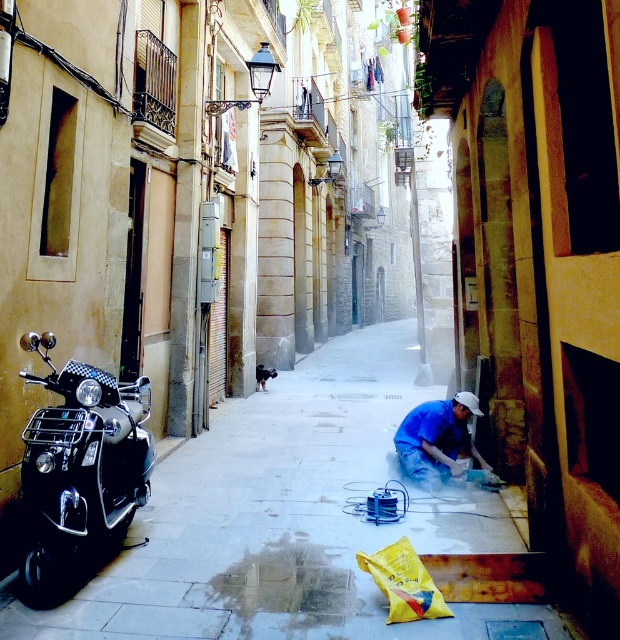
You are a delivery person trying to park your scooter in this alley. The blue fabric at lower right is a laundry line with clothes hanging. To avoid the laundry, where should you position your scooter relative to the smooth concrete pavement at center?

The smooth concrete pavement at center is to the left of blue fabric at lower right, so you should park your scooter on the right side of the smooth concrete pavement at center to avoid the laundry line at blue fabric at lower right.

You are a delivery person who needs to park your scooter on the smooth concrete pavement at center. Can you safely park your scooter there without blocking the shiny black scooter at left?

The smooth concrete pavement at center is positioned under the shiny black scooter at left, meaning the scooter is already occupying that area. Therefore, you cannot park there without blocking it.

In the scene shown: You are standing at the entrance of the alleyway and need to reach the smooth concrete pavement at center. Which direction should you walk to get there?

The smooth concrete pavement at center is located at point (x=290, y=518), so you should walk forward towards the center of the alleyway to reach it.